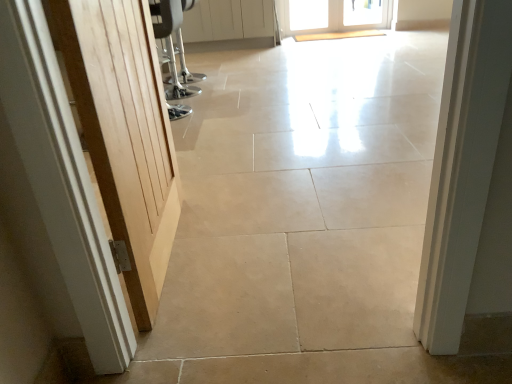
Question: From the image's perspective, is white glass door at upper center, which appears as the first door when viewed from the back, over light wood door at left, acting as the 2th door starting from the left?

Choices:
 (A) yes
 (B) no

Answer: (A)

Question: From the image's perspective, is white glass door at upper center, the third door viewed from the front, under light wood door at left, the second door from the right?

Choices:
 (A) yes
 (B) no

Answer: (B)

Question: Is white glass door at upper center, marked as the 1th door in a top-to-bottom arrangement, at the left side of light wood door at left, arranged as the third door when viewed from the top?

Choices:
 (A) no
 (B) yes

Answer: (A)

Question: Would you say white glass door at upper center, which appears as the first door when viewed from the back, contains light wood door at left, arranged as the third door when viewed from the top?

Choices:
 (A) yes
 (B) no

Answer: (B)

Question: Can you confirm if white glass door at upper center, which appears as the first door when viewed from the back, is positioned to the right of light wood door at left, the second door from the right?

Choices:
 (A) no
 (B) yes

Answer: (B)

Question: Is white glass door at upper center, which is the third door from bottom to top, looking in the opposite direction of light wood door at left, arranged as the third door when viewed from the top?

Choices:
 (A) yes
 (B) no

Answer: (B)

Question: Could you tell me if white glossy door at upper center, the 2th door from the top, is facing light wood door at left, acting as the 2th door starting from the left?

Choices:
 (A) no
 (B) yes

Answer: (B)

Question: Considering the relative sizes of white glossy door at upper center, the second door ordered from the bottom, and light wood door at left, which is the 1th door from bottom to top, in the image provided, is white glossy door at upper center, the second door ordered from the bottom, wider than light wood door at left, which is the 1th door from bottom to top,?

Choices:
 (A) yes
 (B) no

Answer: (A)

Question: Can light wood door at left, arranged as the third door when viewed from the top, be found inside white glossy door at upper center, which is the first door in left-to-right order?

Choices:
 (A) no
 (B) yes

Answer: (A)

Question: Is the surface of white glossy door at upper center, placed as the 2th door when sorted from front to back, in direct contact with light wood door at left, which is the 1th door from bottom to top?

Choices:
 (A) yes
 (B) no

Answer: (B)

Question: From a real-world perspective, is white glossy door at upper center, the second door ordered from the bottom, below light wood door at left, which is the 1th door from bottom to top?

Choices:
 (A) no
 (B) yes

Answer: (B)

Question: From the image's perspective, would you say white glossy door at upper center, the third door in the right-to-left sequence, is positioned over light wood door at left, arranged as the first door when viewed from the front?

Choices:
 (A) no
 (B) yes

Answer: (B)

Question: Is white glass door at upper center, which appears as the first door when viewed from the back, looking in the opposite direction of white glossy door at upper center, which is counted as the second door, starting from the back?

Choices:
 (A) yes
 (B) no

Answer: (B)